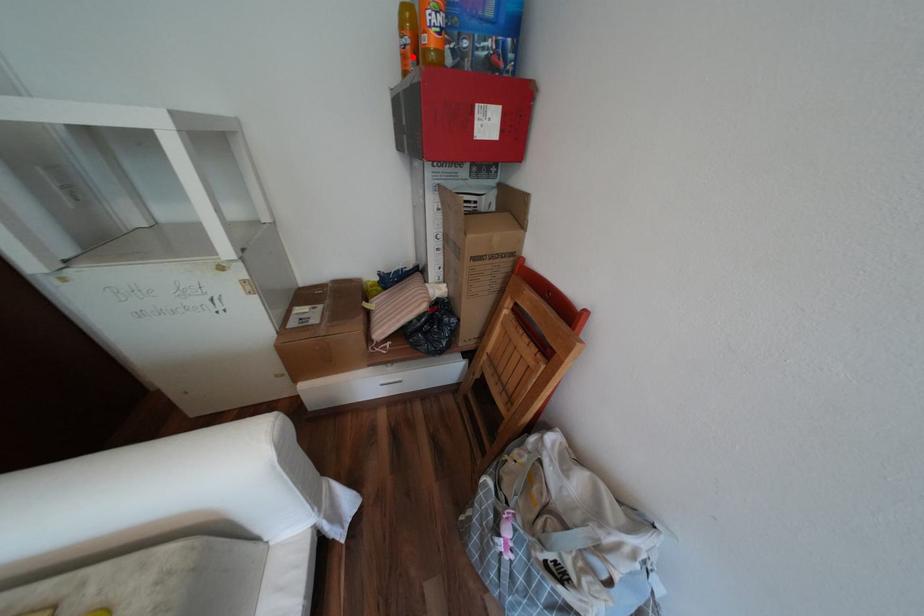
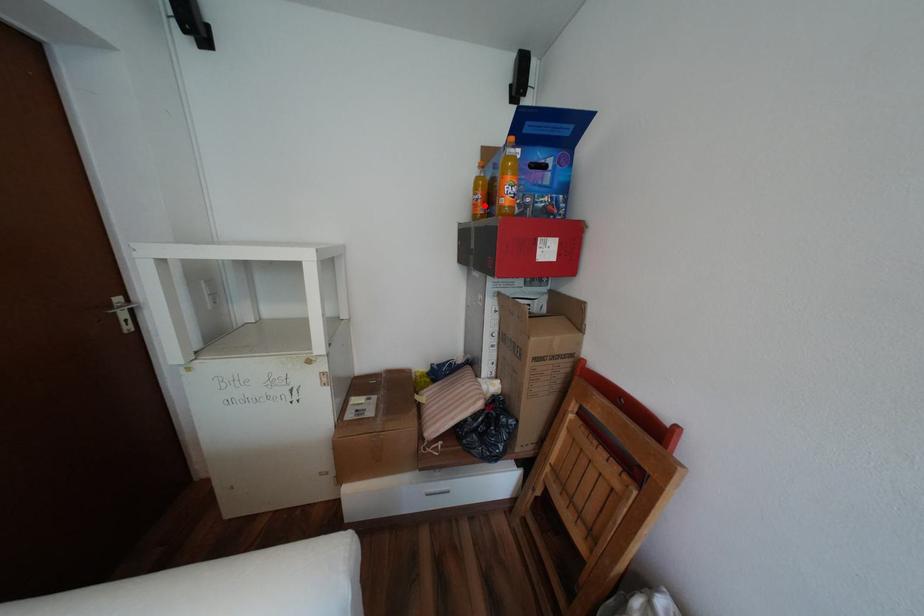
I am providing you with two images of the same scene from different viewpoints. A red point is marked on the first image and another point is marked on the second image. Does the point marked in image1 correspond to the same location as the one in image2?

Yes